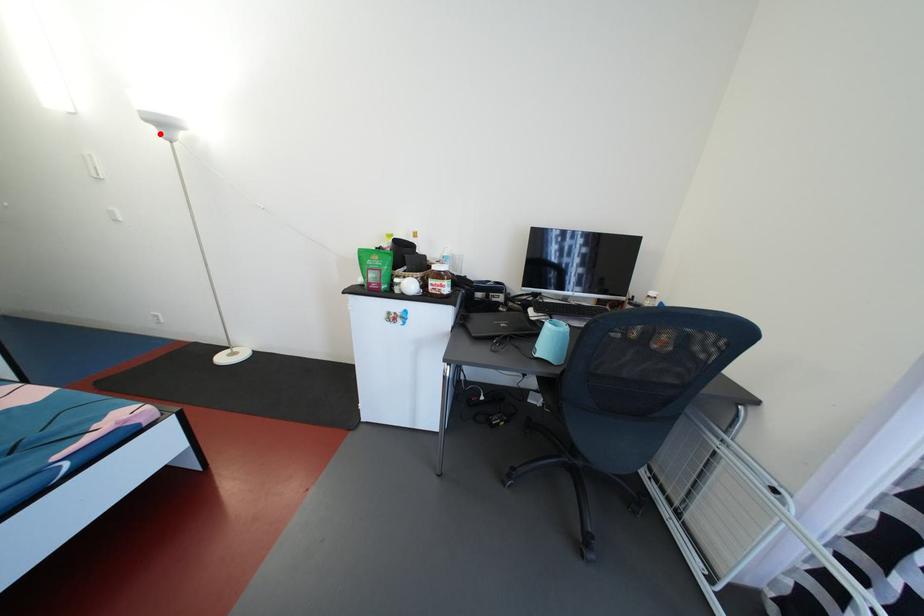
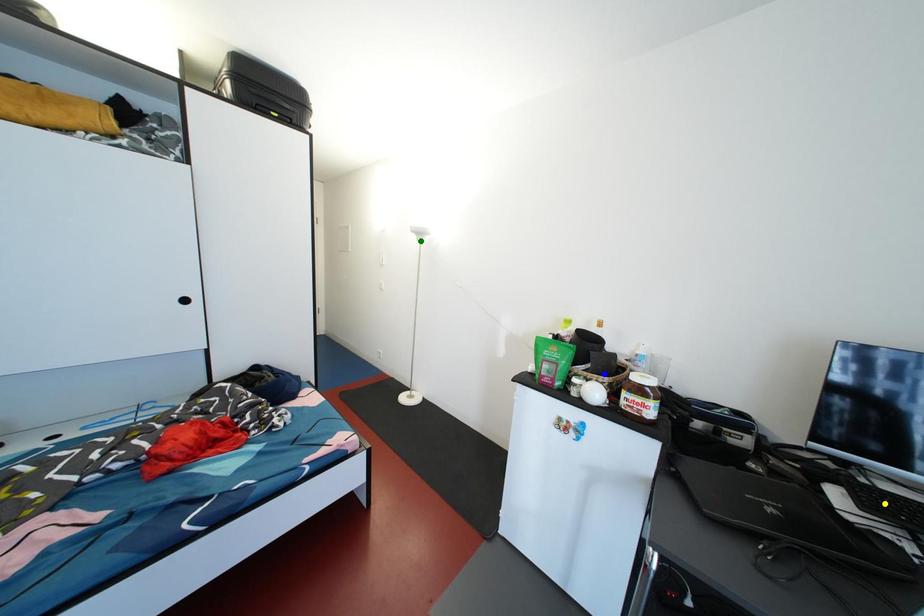
Question: I am providing you with two images of the same scene from different viewpoints. A red point is marked on the first image. You are given multiple points on the second image. Which mark in image 2 goes with the point in image 1?

Choices:
 (A) blue point
 (B) yellow point
 (C) green point

Answer: (C)